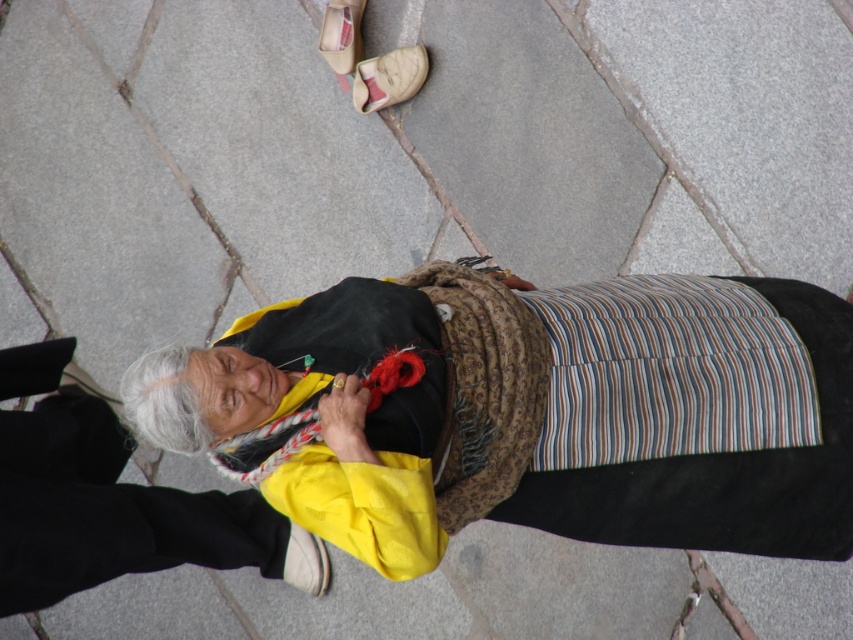
You are a fashion designer observing the beige fabric sandal at upper center and the white leather sandal at upper center. Which sandal has a taller height?

The white leather sandal at upper center is taller than the beige fabric sandal at upper center according to the description.

You are a fashion designer observing the elderly person in the scene. You notice the yellow fabric scarf at center and the beige fabric sandal at upper center. Which item is located to the right of the other?

The yellow fabric scarf at center is positioned on the right side of beige fabric sandal at upper center.